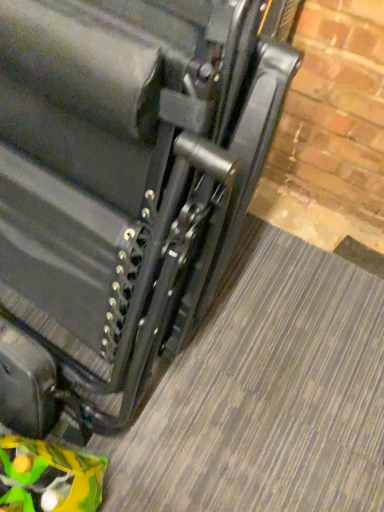
Find the location of a particular element. The image size is (384, 512). green plastic toy at lower left is located at coordinates (49, 476).

Describe the element at coordinates (49, 476) in the screenshot. I see `green plastic toy at lower left` at that location.

The height and width of the screenshot is (512, 384). What do you see at coordinates (125, 182) in the screenshot?
I see `matte black suitcase at center` at bounding box center [125, 182].

Image resolution: width=384 pixels, height=512 pixels. Identify the location of matte black suitcase at center. (125, 182).

This screenshot has height=512, width=384. I want to click on green plastic toy at lower left, so click(49, 476).

Considering the positions of objects green plastic toy at lower left and matte black suitcase at center in the image provided, who is more to the left, green plastic toy at lower left or matte black suitcase at center?

From the viewer's perspective, green plastic toy at lower left appears more on the left side.

Which object is further away from the camera, green plastic toy at lower left or matte black suitcase at center?

green plastic toy at lower left is further from the camera.

Is point (42, 445) less distant than point (47, 362)?

That is True.

From the image's perspective, would you say green plastic toy at lower left is shown under matte black suitcase at center?

Indeed, from the image's perspective, green plastic toy at lower left is shown beneath matte black suitcase at center.

From a real-world perspective, does green plastic toy at lower left stand above matte black suitcase at center?

No, from a real-world perspective, green plastic toy at lower left is not on top of matte black suitcase at center.

Considering the sizes of objects green plastic toy at lower left and matte black suitcase at center in the image provided, who is thinner, green plastic toy at lower left or matte black suitcase at center?

With smaller width is green plastic toy at lower left.

Consider the image. Considering the relative sizes of green plastic toy at lower left and matte black suitcase at center in the image provided, is green plastic toy at lower left taller than matte black suitcase at center?

No.

Which of these two, green plastic toy at lower left or matte black suitcase at center, is smaller?

With smaller size is green plastic toy at lower left.

Is green plastic toy at lower left not within matte black suitcase at center?

Absolutely, green plastic toy at lower left is external to matte black suitcase at center.

Is green plastic toy at lower left in contact with matte black suitcase at center?

green plastic toy at lower left and matte black suitcase at center are not in contact.

Consider the image. Could you tell me if green plastic toy at lower left is facing matte black suitcase at center?

No, green plastic toy at lower left is not oriented towards matte black suitcase at center.

How distant is green plastic toy at lower left from matte black suitcase at center?

A distance of 15.11 inches exists between green plastic toy at lower left and matte black suitcase at center.

Find the location of a particular element. Image resolution: width=384 pixels, height=512 pixels. suitcase that appears above the green plastic toy at lower left (from a real-world perspective) is located at coordinates (125, 182).

In the image, is matte black suitcase at center on the left side or the right side of green plastic toy at lower left?

Clearly, matte black suitcase at center is on the right of green plastic toy at lower left in the image.

Looking at this image, is matte black suitcase at center positioned before green plastic toy at lower left?

Yes, matte black suitcase at center is closer to the camera.

Is point (97, 362) more distant than point (48, 449)?

Yes, point (97, 362) is behind point (48, 449).

From the image's perspective, which is below, matte black suitcase at center or green plastic toy at lower left?

green plastic toy at lower left is shown below in the image.

From a real-world perspective, is matte black suitcase at center positioned over green plastic toy at lower left based on gravity?

Yes, from a real-world perspective, matte black suitcase at center is over green plastic toy at lower left

In terms of width, does matte black suitcase at center look wider or thinner when compared to green plastic toy at lower left?

Clearly, matte black suitcase at center has more width compared to green plastic toy at lower left.

Considering the relative sizes of matte black suitcase at center and green plastic toy at lower left in the image provided, is matte black suitcase at center shorter than green plastic toy at lower left?

In fact, matte black suitcase at center may be taller than green plastic toy at lower left.

In terms of size, does matte black suitcase at center appear bigger or smaller than green plastic toy at lower left?

matte black suitcase at center is bigger than green plastic toy at lower left.

Can green plastic toy at lower left be found inside matte black suitcase at center?

Definitely not — green plastic toy at lower left is not inside matte black suitcase at center.

Are matte black suitcase at center and green plastic toy at lower left far apart?

That's not correct — matte black suitcase at center is a little close to green plastic toy at lower left.

Is matte black suitcase at center looking in the opposite direction of green plastic toy at lower left?

matte black suitcase at center does not have its back to green plastic toy at lower left.

What's the angular difference between matte black suitcase at center and green plastic toy at lower left's facing directions?

The facing directions of matte black suitcase at center and green plastic toy at lower left are 19.7 degrees apart.

Image resolution: width=384 pixels, height=512 pixels. In order to click on suitcase above the green plastic toy at lower left (from the image's perspective) in this screenshot , I will do click(125, 182).

The height and width of the screenshot is (512, 384). Find the location of `toy that is below the matte black suitcase at center (from the image's perspective)`. toy that is below the matte black suitcase at center (from the image's perspective) is located at coordinates (49, 476).

Locate an element on the screen. The image size is (384, 512). suitcase on the right of green plastic toy at lower left is located at coordinates pos(125,182).